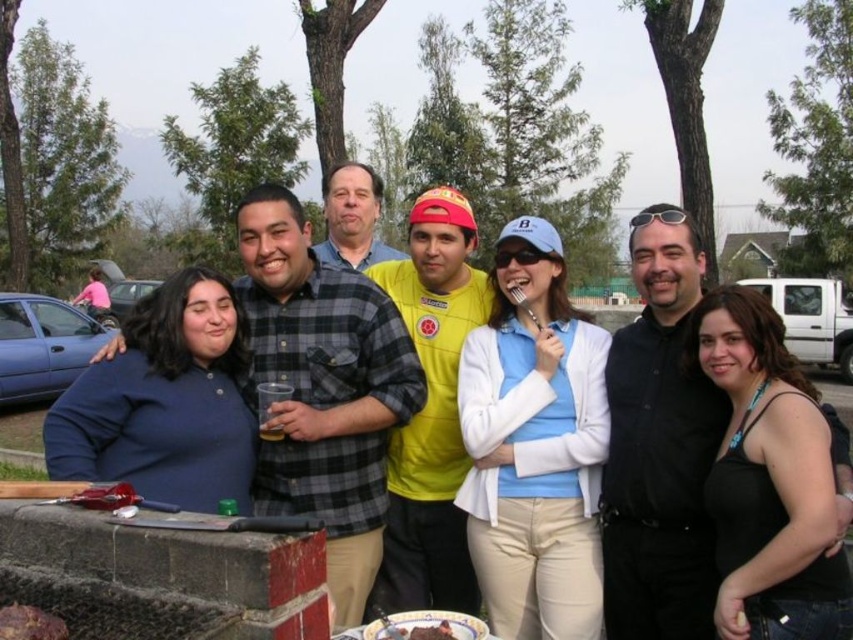
From the picture: You are standing at the origin point of the coordinate system in the image. You need to locate the matte blue shirt at center. Which direction should you move to reach it?

The matte blue shirt at center is located at coordinate point (422, 364), so you should move northeast to reach it.

You are planning to serve dessert at an event and have both the chocolate cake at center and the smooth chocolate cake at lower left available. Which cake should you choose if you want to serve a taller dessert?

The chocolate cake at center is much taller than the smooth chocolate cake at lower left, so you should choose the chocolate cake at center to serve a taller dessert.

You are at a casual outdoor gathering with friends and see two chocolate cakes. One is the chocolate cake at center and the other is the smooth chocolate cake at lower left. Which cake is closer to you?

The chocolate cake at center is closer to you because it is further to the viewer than the smooth chocolate cake at lower left.